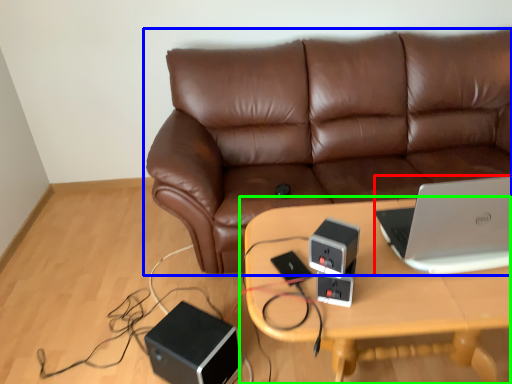
Question: Which object is positioned farthest from laptop (highlighted by a red box)? Select from studio couch (highlighted by a blue box) and table (highlighted by a green box).

Choices:
 (A) studio couch
 (B) table

Answer: (A)